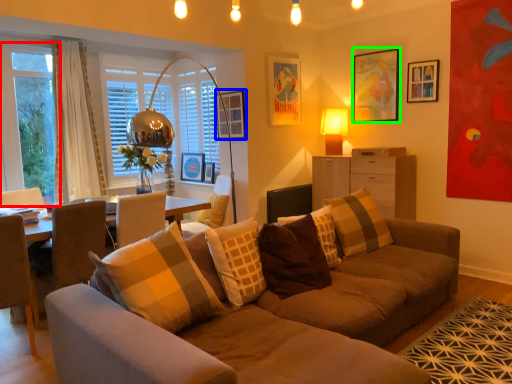
Question: Which object is the farthest from window screen (highlighted by a red box)? Choose among these: picture frame (highlighted by a blue box) or picture frame (highlighted by a green box).

Choices:
 (A) picture frame
 (B) picture frame

Answer: (B)